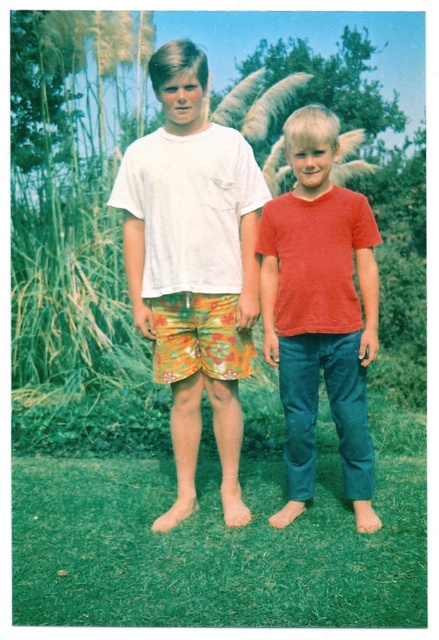
Question: Which object is farther from the camera taking this photo?

Choices:
 (A) floral cotton shorts at center
 (B) matte red t-shirt at center

Answer: (A)

Question: Which point is farther to the camera?

Choices:
 (A) matte red t-shirt at center
 (B) floral cotton shorts at center

Answer: (B)

Question: Does floral cotton shorts at center appear on the left side of matte red t-shirt at center?

Choices:
 (A) no
 (B) yes

Answer: (B)

Question: Is floral cotton shorts at center positioned at the back of matte red t-shirt at center?

Choices:
 (A) no
 (B) yes

Answer: (B)

Question: Does floral cotton shorts at center come behind matte red t-shirt at center?

Choices:
 (A) no
 (B) yes

Answer: (B)

Question: Which of the following is the closest to the observer?

Choices:
 (A) (251, 253)
 (B) (270, 262)

Answer: (B)